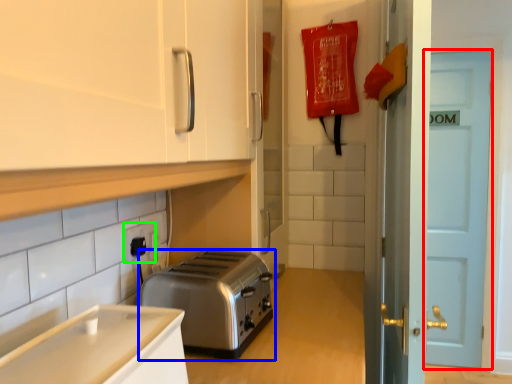
Question: Considering the real-world distances, which object is farthest from door (highlighted by a red box)? toaster (highlighted by a blue box) or electric outlet (highlighted by a green box)?

Choices:
 (A) toaster
 (B) electric outlet

Answer: (B)